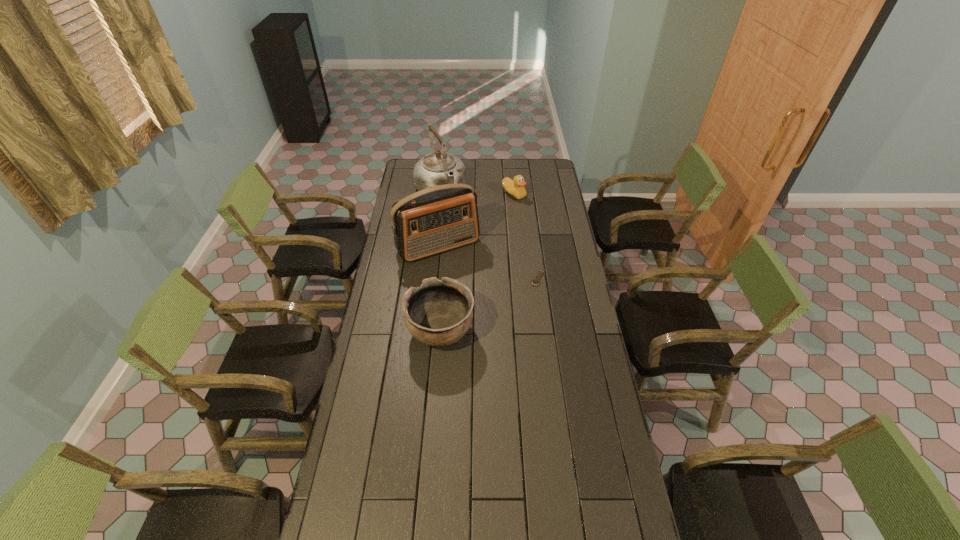
The height and width of the screenshot is (540, 960). I want to click on vacant space situated 0.170m on the front-facing side of the radio receiver, so click(x=469, y=287).

The width and height of the screenshot is (960, 540). In order to click on free space located on the front-facing side of the radio receiver in this screenshot , I will do `click(477, 299)`.

Locate an element on the screen. Image resolution: width=960 pixels, height=540 pixels. vacant region located 0.390m at the spout of the kettle is located at coordinates (477, 253).

The image size is (960, 540). In order to click on free spot located 0.260m at the spout of the kettle in this screenshot , I will do `click(468, 237)`.

In order to click on free spot located at the spout of the kettle in this screenshot , I will do `click(467, 236)`.

Find the location of `free space located at the beak of the duck`. free space located at the beak of the duck is located at coordinates (508, 236).

I want to click on vacant space located at the beak of the duck, so click(x=507, y=245).

The height and width of the screenshot is (540, 960). In order to click on vacant region located 0.250m at the beak of the duck in this screenshot , I will do `click(509, 230)`.

What are the coordinates of `object positioned at the far edge` in the screenshot? It's located at (437, 168).

Image resolution: width=960 pixels, height=540 pixels. In order to click on pottery that is at the left edge in this screenshot , I will do `click(438, 313)`.